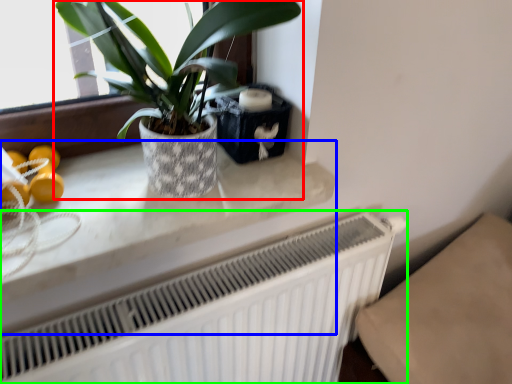
Question: Considering the real-world distances, which object is closest to houseplant (highlighted by a red box)? counter top (highlighted by a blue box) or radiator (highlighted by a green box).

Choices:
 (A) counter top
 (B) radiator

Answer: (A)